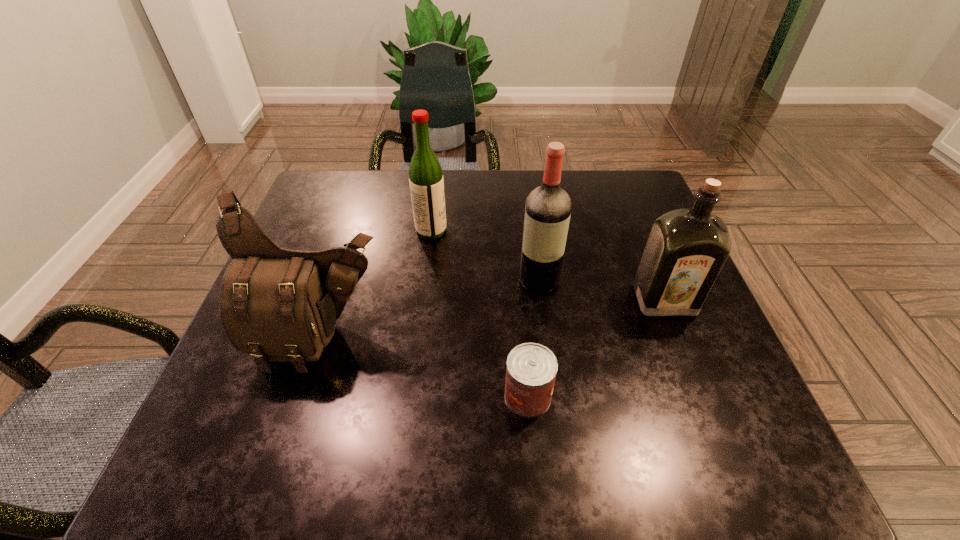
This screenshot has height=540, width=960. In the image, there is a desktop. In order to click on free space at the near right corner in this screenshot , I will do `click(680, 450)`.

You are a GUI agent. You are given a task and a screenshot of the screen. Output one action in this format:
    pyautogui.click(x=<x>, y=<y>)
    Task: Click on the free space between the shortest object and the fourth object from right to left
    Image resolution: width=960 pixels, height=540 pixels.
    Given the screenshot: What is the action you would take?
    pyautogui.click(x=479, y=313)

Identify the location of vacant area that lies between the shortest object and the rightmost object. Image resolution: width=960 pixels, height=540 pixels. (596, 348).

Locate an element on the screen. free space between the second liquor from left to right and the rightmost liquor is located at coordinates (601, 290).

I want to click on vacant space that's between the shoulder bag and the second liquor from left to right, so click(430, 310).

Identify the location of free space between the farthest object and the shortest object. This screenshot has height=540, width=960. (479, 313).

Identify the location of free spot between the second liquor from left to right and the rightmost liquor. (601, 290).

You are a GUI agent. You are given a task and a screenshot of the screen. Output one action in this format:
    pyautogui.click(x=<x>, y=<y>)
    Task: Click on the unoccupied position between the nearest object and the second liquor from right to left
    
    Given the screenshot: What is the action you would take?
    pyautogui.click(x=533, y=338)

You are a GUI agent. You are given a task and a screenshot of the screen. Output one action in this format:
    pyautogui.click(x=<x>, y=<y>)
    Task: Click on the vacant space that's between the rightmost object and the nearest object
    
    Given the screenshot: What is the action you would take?
    pyautogui.click(x=596, y=348)

You are a GUI agent. You are given a task and a screenshot of the screen. Output one action in this format:
    pyautogui.click(x=<x>, y=<y>)
    Task: Click on the vacant area that lies between the can and the second liquor from right to left
    
    Given the screenshot: What is the action you would take?
    pyautogui.click(x=533, y=338)